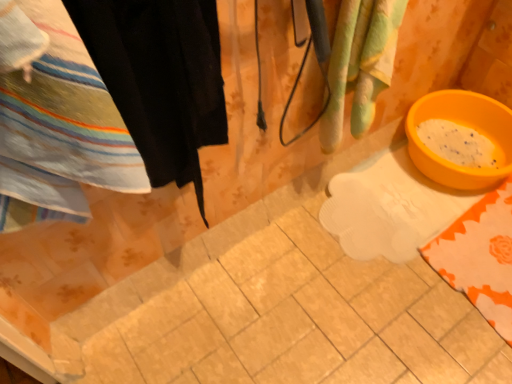
Question: Is black fabric at left thinner than orange plastic basin at lower right?

Choices:
 (A) no
 (B) yes

Answer: (B)

Question: Could you tell me if black fabric at left is turned towards orange plastic basin at lower right?

Choices:
 (A) yes
 (B) no

Answer: (B)

Question: Is black fabric at left bigger than orange plastic basin at lower right?

Choices:
 (A) no
 (B) yes

Answer: (A)

Question: Is black fabric at left wider than orange plastic basin at lower right?

Choices:
 (A) yes
 (B) no

Answer: (B)

Question: From a real-world perspective, is black fabric at left below orange plastic basin at lower right?

Choices:
 (A) no
 (B) yes

Answer: (A)

Question: Can you confirm if black fabric at left is positioned to the left of orange plastic basin at lower right?

Choices:
 (A) yes
 (B) no

Answer: (A)

Question: Does green striped towel at upper right come in front of black fabric at left?

Choices:
 (A) yes
 (B) no

Answer: (B)

Question: Considering the relative positions of green striped towel at upper right and black fabric at left in the image provided, is green striped towel at upper right to the right of black fabric at left from the viewer's perspective?

Choices:
 (A) yes
 (B) no

Answer: (A)

Question: Is green striped towel at upper right far from black fabric at left?

Choices:
 (A) yes
 (B) no

Answer: (B)

Question: Can you confirm if green striped towel at upper right is wider than black fabric at left?

Choices:
 (A) yes
 (B) no

Answer: (A)

Question: From the image's perspective, is green striped towel at upper right above black fabric at left?

Choices:
 (A) yes
 (B) no

Answer: (A)

Question: Is green striped towel at upper right further to the viewer compared to black fabric at left?

Choices:
 (A) yes
 (B) no

Answer: (A)

Question: Is striped cotton towel at left to the right of orange plastic basin at lower right from the viewer's perspective?

Choices:
 (A) yes
 (B) no

Answer: (B)